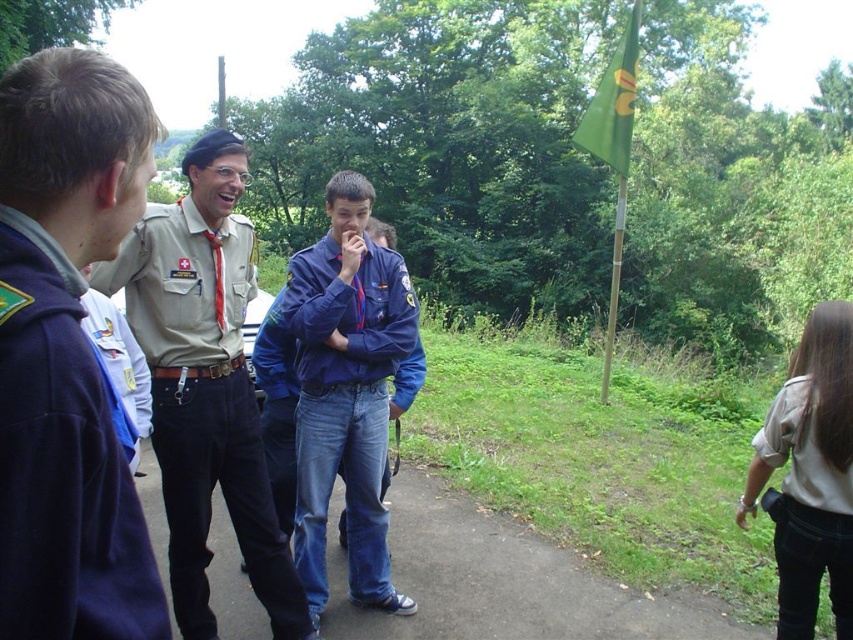
Question: Which point is closer to the camera?

Choices:
 (A) navy blue fleece at left
 (B) blue denim jacket at center

Answer: (A)

Question: Which object is positioned closest to the khaki uniform at center?

Choices:
 (A) matte khaki shirt at left
 (B) light beige shirt at lower right
 (C) green fabric flag at upper right

Answer: (A)

Question: Which of the following is the farthest from the observer?

Choices:
 (A) light beige shirt at lower right
 (B) matte khaki shirt at left
 (C) khaki uniform at center
 (D) navy blue fleece at left

Answer: (C)

Question: In this image, where is khaki uniform at center located relative to green fabric flag at upper right?

Choices:
 (A) above
 (B) below

Answer: (B)

Question: Observing the image, what is the correct spatial positioning of khaki uniform at center in reference to light beige shirt at lower right?

Choices:
 (A) above
 (B) below

Answer: (A)

Question: Does khaki uniform at center have a larger size compared to green fabric flag at upper right?

Choices:
 (A) no
 (B) yes

Answer: (A)